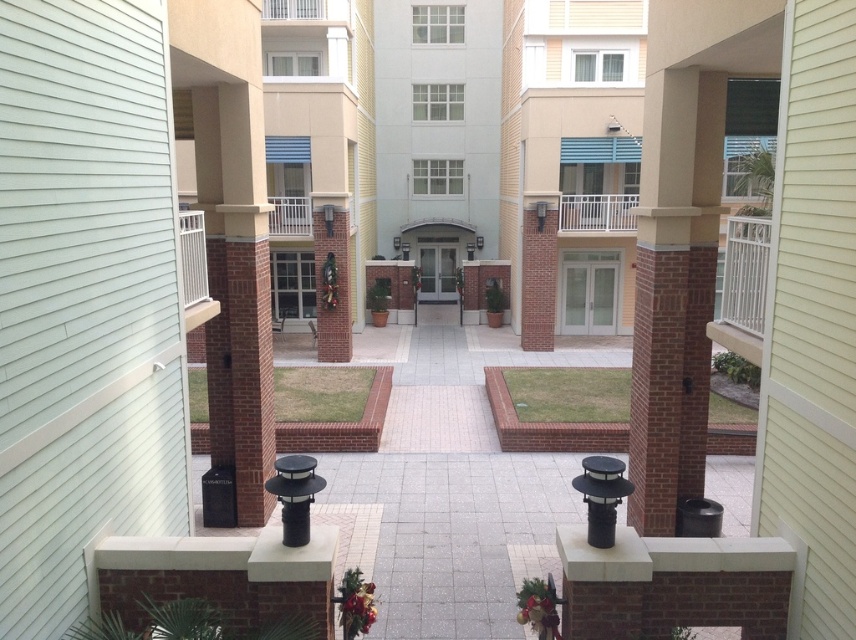
You are standing at the entrance of the courtyard and want to reach the white metal balcony at upper center. Which balcony should you look up towards from the white painted wood balcony at left?

The white painted wood balcony at left is located below the white metal balcony at upper center, so you should look up towards the white metal balcony at upper center.

You are standing at the entrance of the courtyard and want to compare the heights of the white painted wood balcony at left and the white metal railing at upper center. Which one is taller?

The white painted wood balcony at left is taller than the white metal railing at upper center.

You are standing at the entrance of the courtyard and looking towards the upper part of the building. Which object is positioned higher up between the white metal railing at upper center and the white metal balcony at upper center?

The white metal railing at upper center is positioned higher up than the white metal balcony at upper center as it is located above it.